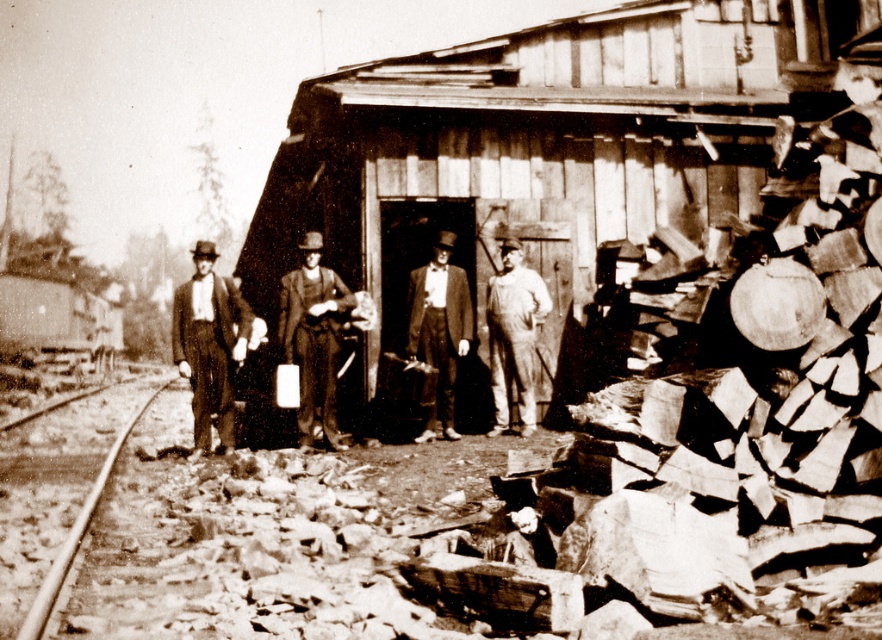
You are a photographer setting up a tripod in the scene. You need to place it between the wooden hut at center and the denim overalls at center. Which object should you place it closer to if you want the tripod to be closer to the larger object?

The wooden hut at center is larger than the denim overalls at center, so you should place the tripod closer to the wooden hut at center to be near the larger object.

Consider the image. You are a photographer standing in front of the wooden structure. You want to focus your camera lens on the smooth black suit at center. However, the smooth metal track at lower left is blocking your view. Can you adjust your position to avoid the track while still keeping the suit in the frame?

The smooth metal track at lower left is closer to the viewer than the smooth black suit at center. To avoid the track while keeping the suit in the frame, you can move either to the right or left to shift the angle so the track no longer blocks the view of the suit.